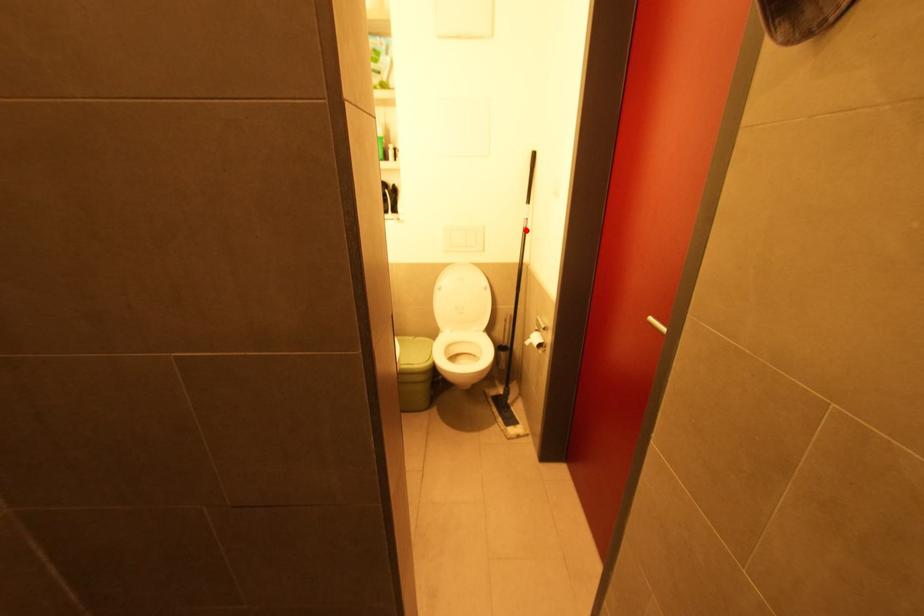
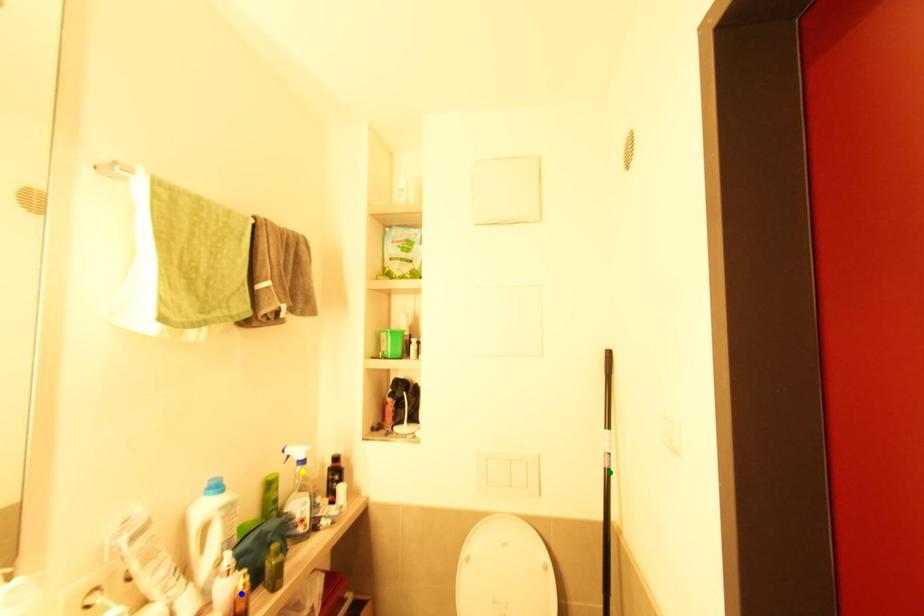
Question: I am providing you with two images of the same scene from different viewpoints. A red point is marked on the first image. You are given multiple points on the second image. Which point in image 2 represents the same 3d spot as the red point in image 1?

Choices:
 (A) green point
 (B) blue point
 (C) yellow point

Answer: (A)